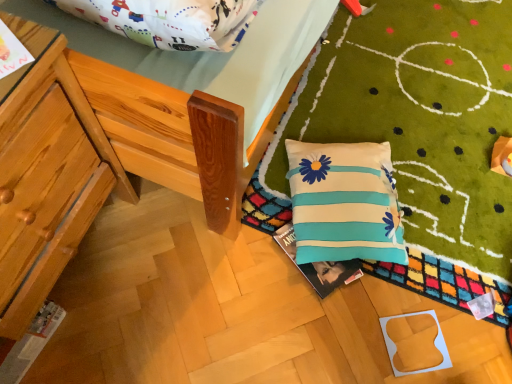
Question: Which direction should I rotate to look at white fabric pillow with blue stripes and flower patterns at lower right — up or down?

Choices:
 (A) up
 (B) down

Answer: (B)

Question: Does wooden chair at left have a lesser height compared to white fabric pillow with blue stripes and flower patterns at lower right?

Choices:
 (A) yes
 (B) no

Answer: (B)

Question: Is wooden chair at left far away from white fabric pillow with blue stripes and flower patterns at lower right?

Choices:
 (A) no
 (B) yes

Answer: (A)

Question: Is wooden chair at left positioned beyond the bounds of white fabric pillow with blue stripes and flower patterns at lower right?

Choices:
 (A) yes
 (B) no

Answer: (A)

Question: Considering the relative sizes of wooden chair at left and white fabric pillow with blue stripes and flower patterns at lower right in the image provided, is wooden chair at left bigger than white fabric pillow with blue stripes and flower patterns at lower right?

Choices:
 (A) no
 (B) yes

Answer: (B)

Question: Are wooden chair at left and white fabric pillow with blue stripes and flower patterns at lower right beside each other?

Choices:
 (A) no
 (B) yes

Answer: (A)

Question: From the image's perspective, is wooden chair at left below white fabric pillow with blue stripes and flower patterns at lower right?

Choices:
 (A) no
 (B) yes

Answer: (B)

Question: Does white fabric pillow with blue stripes and flower patterns at lower right have a smaller size compared to wooden chair at left?

Choices:
 (A) no
 (B) yes

Answer: (B)

Question: Is white fabric pillow with blue stripes and flower patterns at lower right thinner than wooden chair at left?

Choices:
 (A) yes
 (B) no

Answer: (A)

Question: Does white fabric pillow with blue stripes and flower patterns at lower right have a greater width compared to wooden chair at left?

Choices:
 (A) yes
 (B) no

Answer: (B)

Question: Is white fabric pillow with blue stripes and flower patterns at lower right taller than wooden chair at left?

Choices:
 (A) no
 (B) yes

Answer: (A)

Question: From the image's perspective, is white fabric pillow with blue stripes and flower patterns at lower right located beneath wooden chair at left?

Choices:
 (A) no
 (B) yes

Answer: (A)

Question: Is white fabric pillow with blue stripes and flower patterns at lower right to the left of wooden chair at left from the viewer's perspective?

Choices:
 (A) no
 (B) yes

Answer: (A)

Question: Is wooden chair at left wider or thinner than white fabric pillow with blue stripes and flower patterns at lower right?

Choices:
 (A) wide
 (B) thin

Answer: (A)